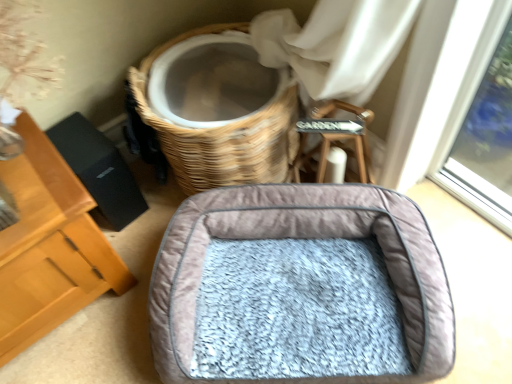
Question: In the image, is woven wood basket at upper center positioned in front of or behind gray plush dog bed at center?

Choices:
 (A) behind
 (B) front

Answer: (A)

Question: Is woven wood basket at upper center bigger or smaller than gray plush dog bed at center?

Choices:
 (A) big
 (B) small

Answer: (A)

Question: Is point (276, 150) closer or farther from the camera than point (438, 342)?

Choices:
 (A) closer
 (B) farther

Answer: (B)

Question: From their relative heights in the image, would you say gray plush dog bed at center is taller or shorter than woven wood basket at upper center?

Choices:
 (A) short
 (B) tall

Answer: (A)

Question: From the image's perspective, is gray plush dog bed at center located above or below woven wood basket at upper center?

Choices:
 (A) below
 (B) above

Answer: (A)

Question: Considering the positions of gray plush dog bed at center and woven wood basket at upper center in the image, is gray plush dog bed at center wider or thinner than woven wood basket at upper center?

Choices:
 (A) thin
 (B) wide

Answer: (B)

Question: From a real-world perspective, is gray plush dog bed at center above or below woven wood basket at upper center?

Choices:
 (A) below
 (B) above

Answer: (A)